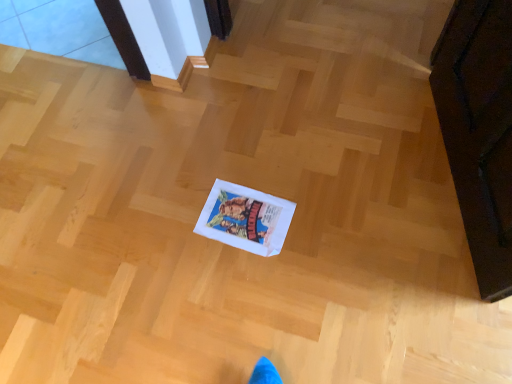
What is the approximate height of white paper comic book at center?

white paper comic book at center is 0.70 inches tall.

You are a GUI agent. You are given a task and a screenshot of the screen. Output one action in this format:
    pyautogui.click(x=<x>, y=<y>)
    Task: Click on the white paper comic book at center
    The width and height of the screenshot is (512, 384).
    Given the screenshot: What is the action you would take?
    pyautogui.click(x=245, y=218)

This screenshot has width=512, height=384. Describe the element at coordinates (245, 218) in the screenshot. I see `white paper comic book at center` at that location.

At what (x,y) coordinates should I click in order to perform the action: click on white paper comic book at center. Please return your answer as a coordinate pair (x, y). The width and height of the screenshot is (512, 384). Looking at the image, I should click on (245, 218).